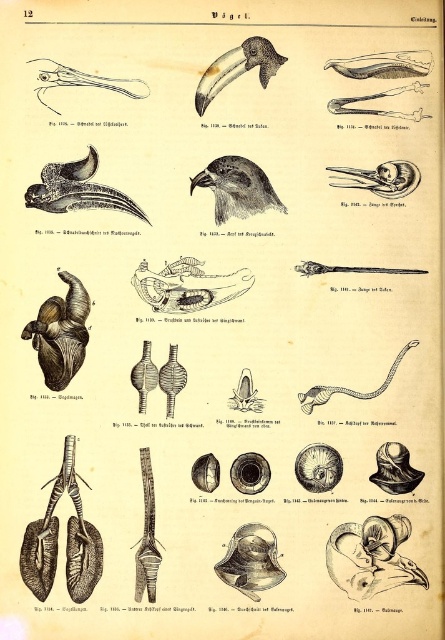
Is brown leather heart at center wider than bone-like skeleton at upper right?

Incorrect, brown leather heart at center's width does not surpass bone-like skeleton at upper right's.

Image resolution: width=445 pixels, height=640 pixels. What do you see at coordinates (60, 333) in the screenshot? I see `brown leather heart at center` at bounding box center [60, 333].

Does point (59, 364) come in front of point (359, 168)?

That is True.

What are the coordinates of `brown leather heart at center` in the screenshot? It's located at (60, 333).

Who is more distant from viewer, (48, 333) or (227, 74)?

Positioned behind is point (48, 333).

Which of these two, brown leather heart at center or black glossy beak at upper center, stands shorter?

black glossy beak at upper center is shorter.

The height and width of the screenshot is (640, 445). Describe the element at coordinates (60, 333) in the screenshot. I see `brown leather heart at center` at that location.

Find the location of a particular element. The image size is (445, 640). brown leather heart at center is located at coordinates (60, 333).

Does bone-like skeleton at upper right appear under smooth gray snake at center?

No.

Is point (347, 173) positioned in front of point (367, 394)?

That is False.

Does point (346, 176) lie behind point (323, 400)?

Yes.

The image size is (445, 640). Find the location of `bone-like skeleton at upper right`. bone-like skeleton at upper right is located at coordinates (379, 179).